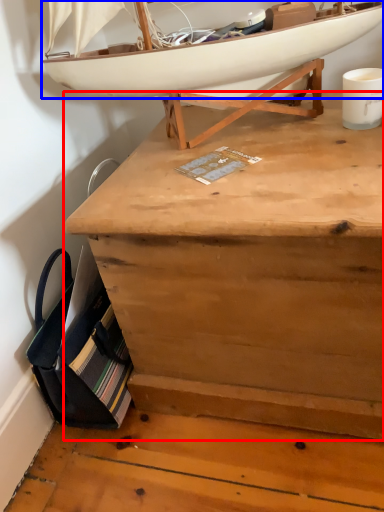
Question: Which object appears farthest to the camera in this image, desk (highlighted by a red box) or boat (highlighted by a blue box)?

Choices:
 (A) desk
 (B) boat

Answer: (B)